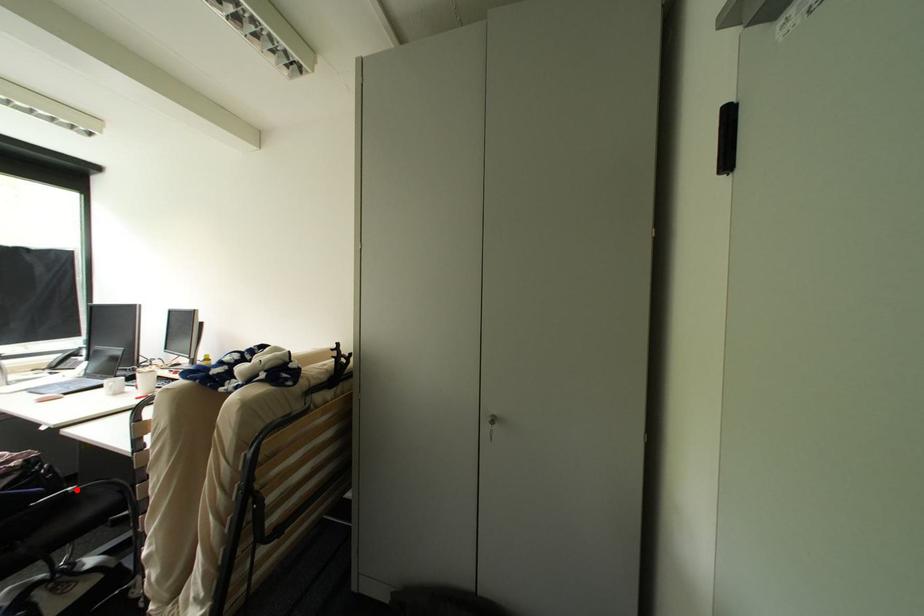
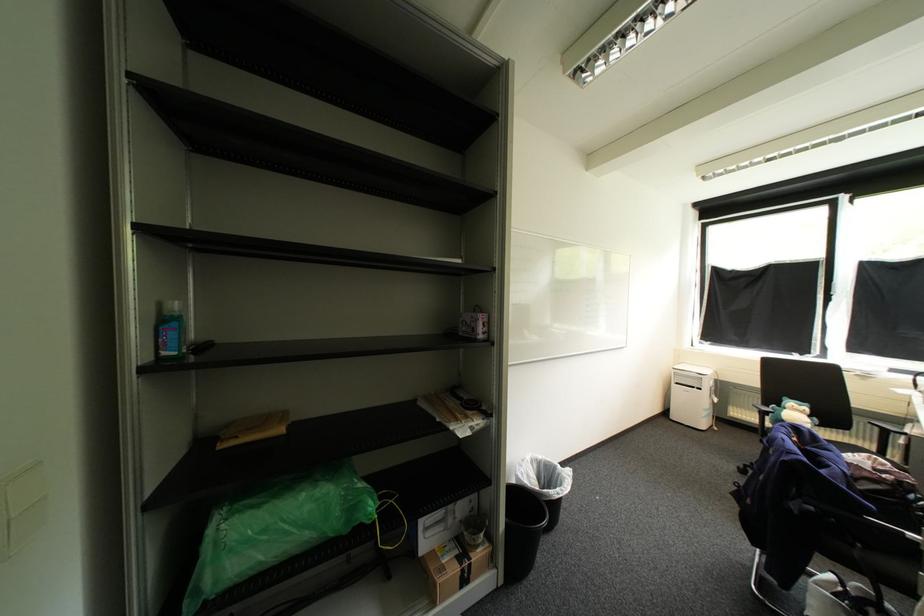
The point at the highlighted location is marked in the first image. Where is the corresponding point in the second image?

(917, 535)